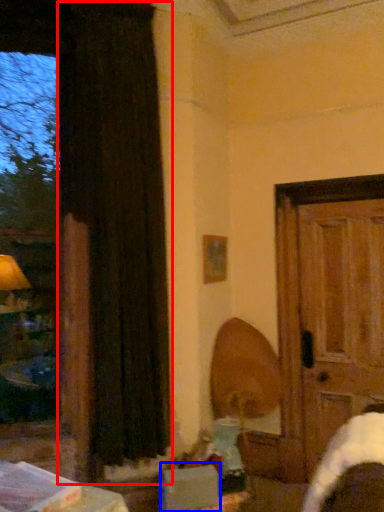
Question: Which point is further to the camera, curtain (highlighted by a red box) or cardboard box (highlighted by a blue box)?

Choices:
 (A) curtain
 (B) cardboard box

Answer: (A)